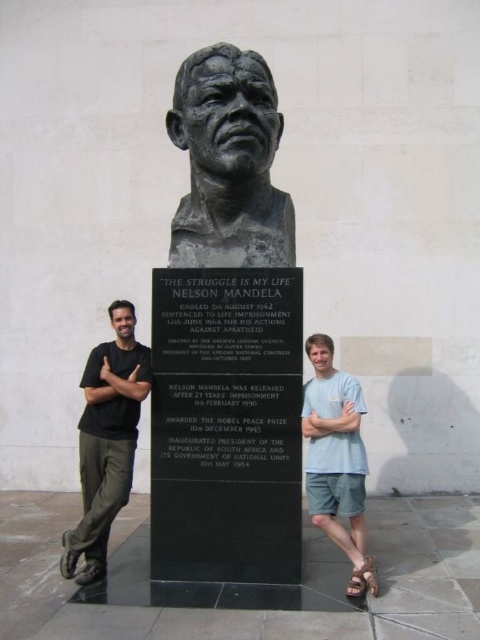
Can you confirm if bronze sculpture at center is smaller than light blue t-shirt at right?

No, bronze sculpture at center is not smaller than light blue t-shirt at right.

Is bronze sculpture at center in front of light blue t-shirt at right?

No, it is not.

This screenshot has width=480, height=640. I want to click on bronze sculpture at center, so click(x=228, y=163).

Between bronze sculpture at center and black cotton shirt at left, which one has more height?

With more height is black cotton shirt at left.

Can you confirm if bronze sculpture at center is positioned above black cotton shirt at left?

Yes.

Which is in front, point (250, 84) or point (108, 445)?

Point (250, 84) is more forward.

Image resolution: width=480 pixels, height=640 pixels. Identify the location of bronze sculpture at center. (228, 163).

In the scene shown: Which is below, black cotton shirt at left or light blue t-shirt at right?

Positioned lower is light blue t-shirt at right.

Which is more to the left, black cotton shirt at left or light blue t-shirt at right?

black cotton shirt at left is more to the left.

Identify the location of black cotton shirt at left. The height and width of the screenshot is (640, 480). (107, 440).